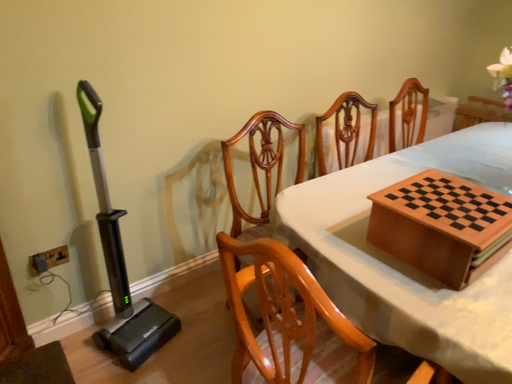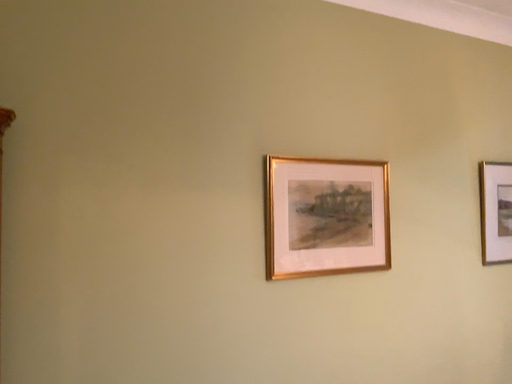
Question: How did the camera likely rotate when shooting the video?

Choices:
 (A) rotated left
 (B) rotated right

Answer: (A)